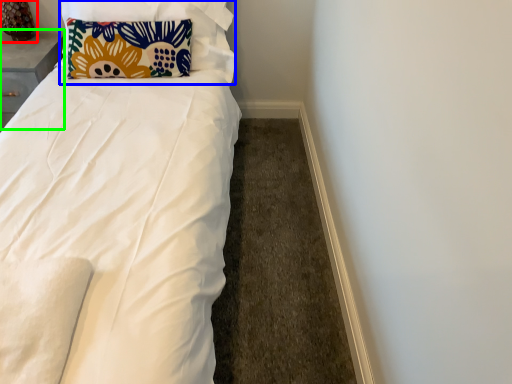
Question: Which object is the closest to the table lamp (highlighted by a red box)? Choose among these: pillow (highlighted by a blue box) or table (highlighted by a green box).

Choices:
 (A) pillow
 (B) table

Answer: (B)